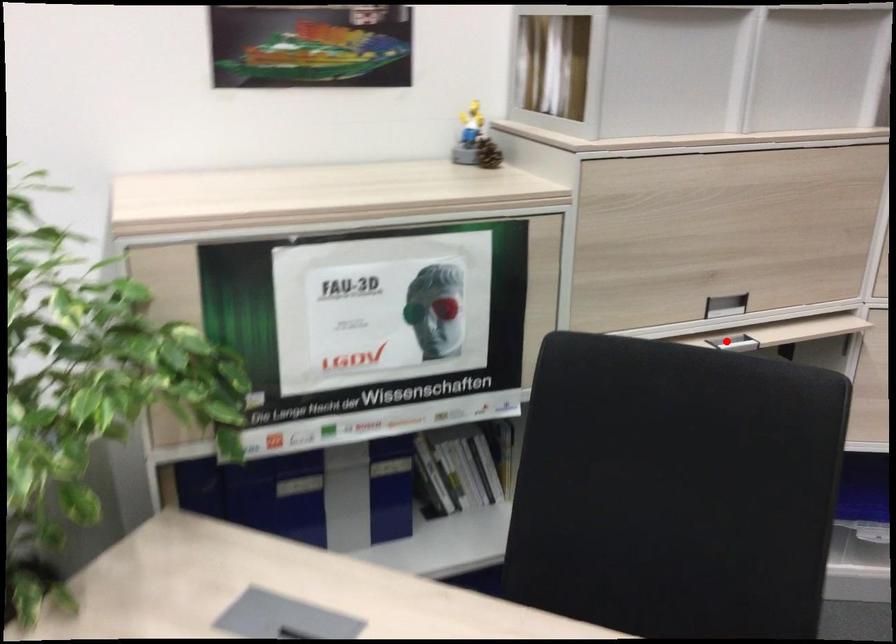
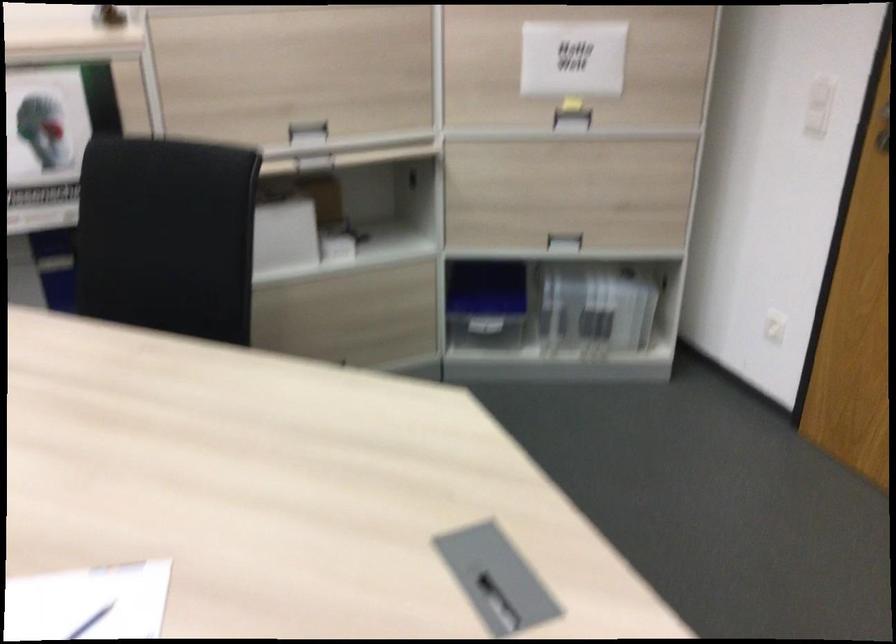
Find the pixel in the second image that matches the highlighted location in the first image.

(314, 164)